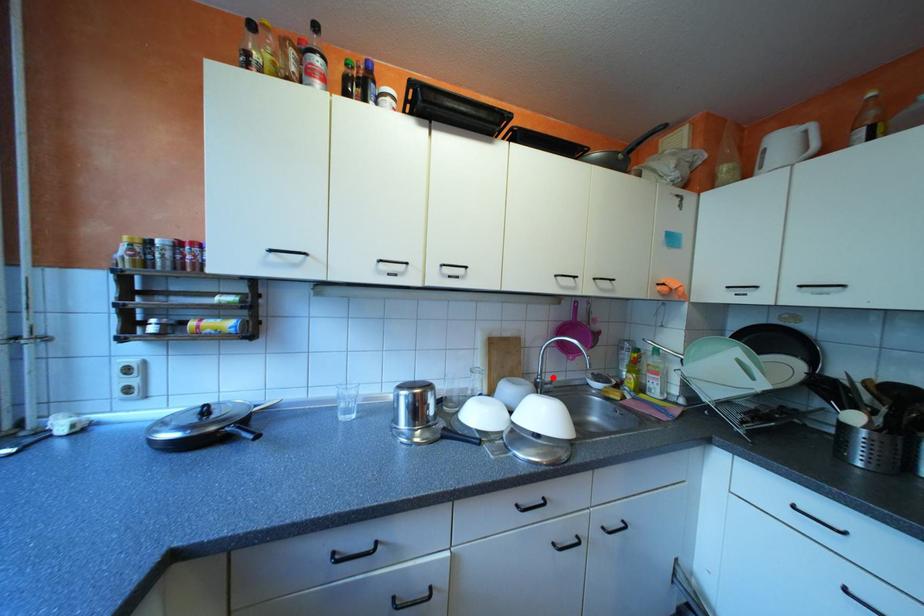
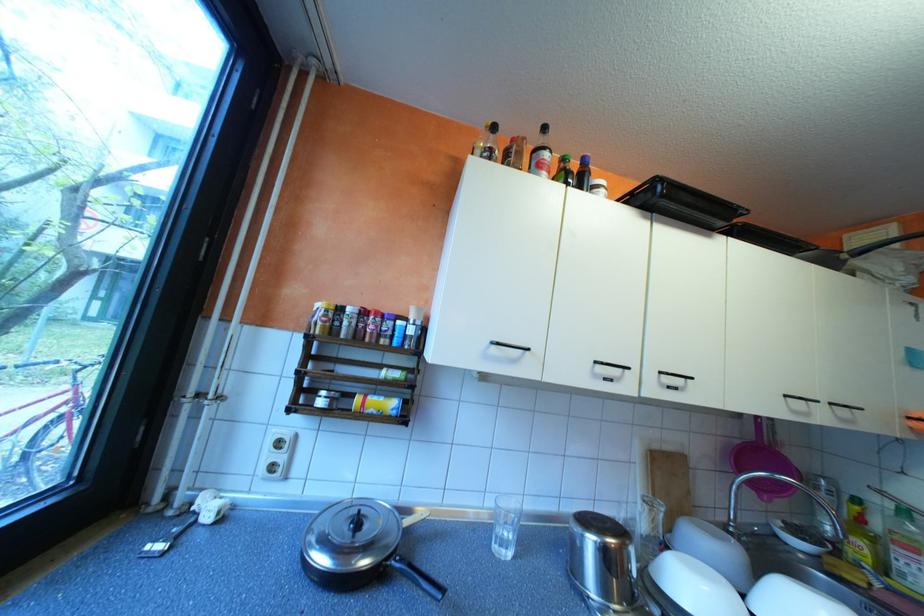
Find the pixel in the second image that matches the highlighted location in the first image.

(747, 525)